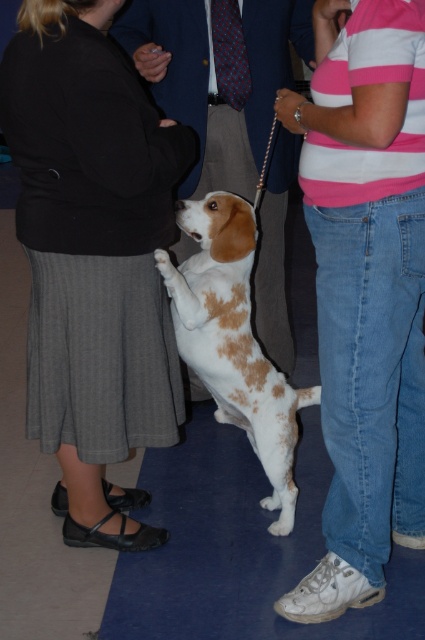
Between white fur dog at center and spotted fur dog at center, which one appears on the left side from the viewer's perspective?

Positioned to the left is spotted fur dog at center.

The height and width of the screenshot is (640, 425). Describe the element at coordinates (218, 76) in the screenshot. I see `white fur dog at center` at that location.

The height and width of the screenshot is (640, 425). I want to click on white fur dog at center, so click(218, 76).

Between matte black jacket at center and white fur dog at center, which one has more height?

With more height is matte black jacket at center.

This screenshot has width=425, height=640. Describe the element at coordinates (93, 259) in the screenshot. I see `matte black jacket at center` at that location.

This screenshot has height=640, width=425. Identify the location of matte black jacket at center. (93, 259).

Can you confirm if matte black jacket at center is bigger than pink striped shirt at upper right?

Correct, matte black jacket at center is larger in size than pink striped shirt at upper right.

Does matte black jacket at center have a smaller size compared to pink striped shirt at upper right?

No.

Is point (130, 438) farther from camera compared to point (368, 246)?

Yes, it is behind point (368, 246).

The height and width of the screenshot is (640, 425). I want to click on matte black jacket at center, so click(93, 259).